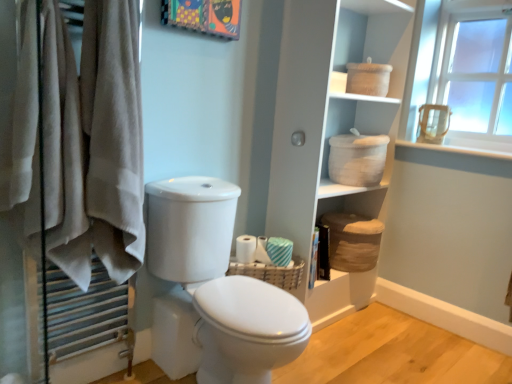
What are the coordinates of `free point in front of white woven baskets at upper center` in the screenshot? It's located at coord(364,346).